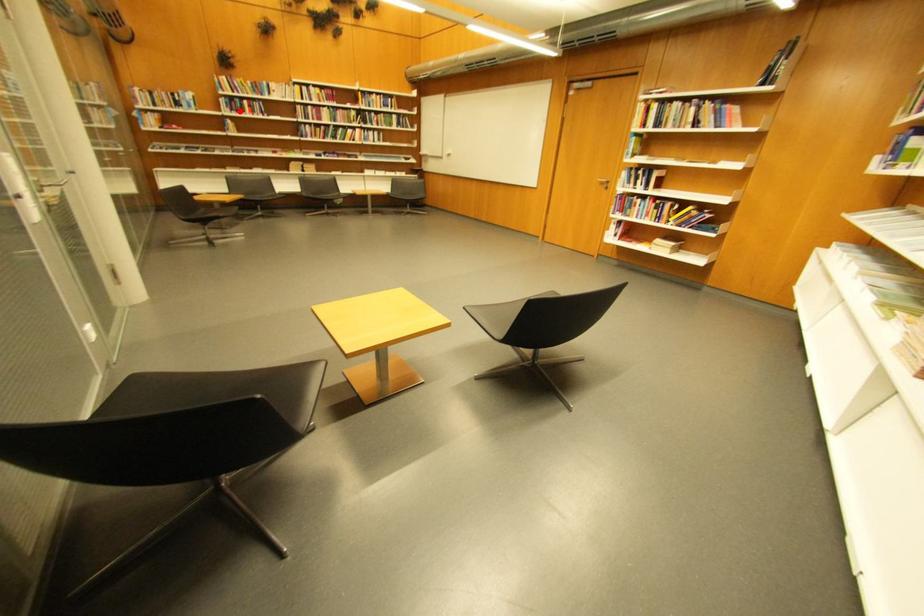
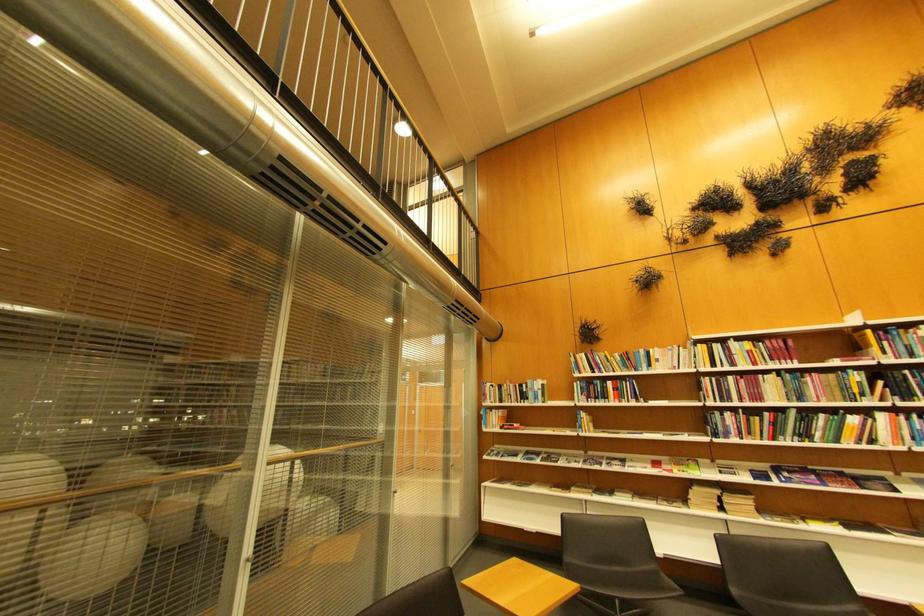
In the second image, find the point that corresponds to the highlighted location in the first image.

(594, 399)